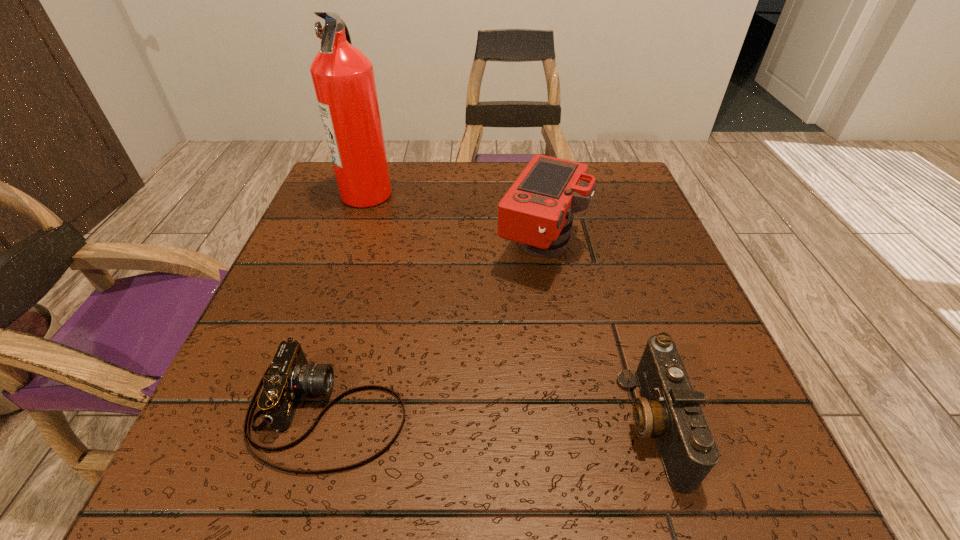
The height and width of the screenshot is (540, 960). What are the coordinates of `free area in between the tallest object and the tallest camera` in the screenshot? It's located at (454, 220).

You are a GUI agent. You are given a task and a screenshot of the screen. Output one action in this format:
    pyautogui.click(x=<x>, y=<y>)
    Task: Click on the free point between the fire extinguisher and the shortest camera
    The height and width of the screenshot is (540, 960).
    Given the screenshot: What is the action you would take?
    pyautogui.click(x=348, y=302)

Where is `vacant area between the shortest object and the tallest object`? Image resolution: width=960 pixels, height=540 pixels. vacant area between the shortest object and the tallest object is located at coordinates (x=348, y=302).

Locate an element on the screen. vacant point located between the third tallest object and the farthest camera is located at coordinates (x=597, y=335).

The image size is (960, 540). I want to click on free spot between the tallest camera and the second tallest camera, so click(x=597, y=335).

Identify which object is the third closest to the farthest camera. Please provide its 2D coordinates. Your answer should be formatted as a tuple, i.e. [(x, y)], where the tuple contains the x and y coordinates of a point satisfying the conditions above.

[(343, 77)]

Where is `object that is the third closest to the shortest object`? This screenshot has width=960, height=540. object that is the third closest to the shortest object is located at coordinates click(343, 77).

Locate an element on the screen. the closest camera to the third nearest object is located at coordinates (669, 409).

Locate an element on the screen. The height and width of the screenshot is (540, 960). camera that is the second closest to the leftmost camera is located at coordinates (669, 409).

The image size is (960, 540). Find the location of `free spot that satisfies the following two spatial constraints: 1. at the nozzle of the tallest object; 2. on the left side of the second tallest object`. free spot that satisfies the following two spatial constraints: 1. at the nozzle of the tallest object; 2. on the left side of the second tallest object is located at coordinates (348, 247).